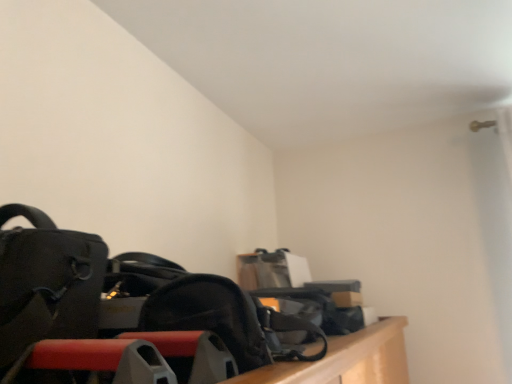
Question: Does matte black bag at left have a greater width compared to black matte shoulder bag at center?

Choices:
 (A) no
 (B) yes

Answer: (B)

Question: From the image's perspective, is matte black bag at left located beneath black matte shoulder bag at center?

Choices:
 (A) yes
 (B) no

Answer: (B)

Question: From a real-world perspective, is matte black bag at left positioned over black matte shoulder bag at center based on gravity?

Choices:
 (A) yes
 (B) no

Answer: (A)

Question: Is matte black bag at left bigger than black matte shoulder bag at center?

Choices:
 (A) no
 (B) yes

Answer: (B)

Question: Can we say matte black bag at left lies outside black matte shoulder bag at center?

Choices:
 (A) yes
 (B) no

Answer: (A)

Question: Does matte black bag at left have a lesser height compared to black matte shoulder bag at center?

Choices:
 (A) no
 (B) yes

Answer: (A)

Question: From a real-world perspective, is black matte shoulder bag at center on matte black bag at left?

Choices:
 (A) yes
 (B) no

Answer: (B)

Question: Can matte black bag at left be found inside black matte shoulder bag at center?

Choices:
 (A) yes
 (B) no

Answer: (B)

Question: Is black matte shoulder bag at center to the right of matte black bag at left from the viewer's perspective?

Choices:
 (A) yes
 (B) no

Answer: (A)

Question: Can you confirm if black matte shoulder bag at center is smaller than matte black bag at left?

Choices:
 (A) yes
 (B) no

Answer: (A)

Question: Is black matte shoulder bag at center not within matte black bag at left?

Choices:
 (A) no
 (B) yes

Answer: (B)

Question: Can you see black matte shoulder bag at center touching matte black bag at left?

Choices:
 (A) no
 (B) yes

Answer: (A)

Question: Would you say matte black bag at left is to the left or to the right of black matte shoulder bag at center in the picture?

Choices:
 (A) left
 (B) right

Answer: (A)